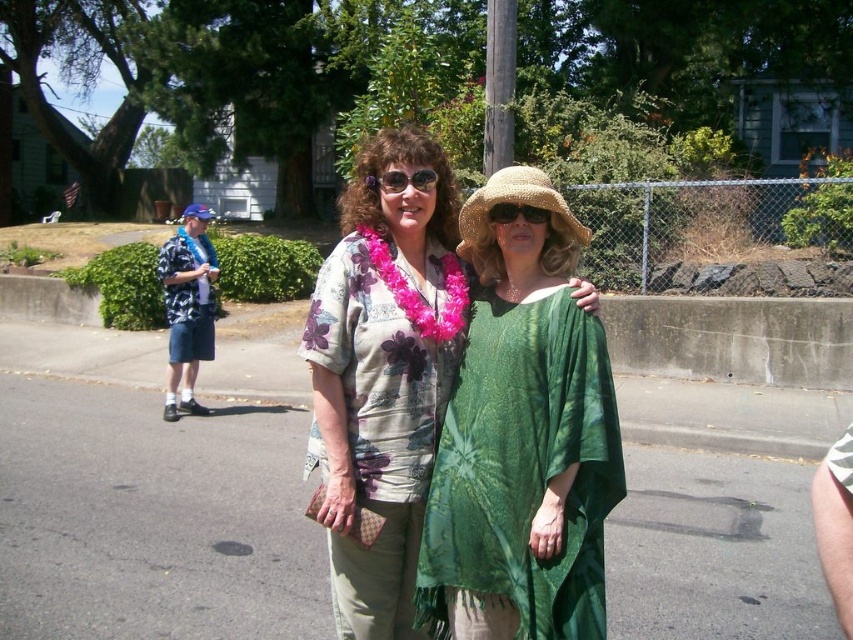
Looking at this image, measure the distance between point (408, 612) and camera.

They are 2.83 meters apart.

Is floral print blouse at center above green tie-dye dress at center?

Indeed, floral print blouse at center is positioned over green tie-dye dress at center.

Does point (415, 474) lie behind point (526, 340)?

Yes, it is behind point (526, 340).

The image size is (853, 640). Identify the location of floral print blouse at center. (383, 376).

At what (x,y) coordinates should I click in order to perform the action: click on floral print blouse at center. Please return your answer as a coordinate pair (x, y). The width and height of the screenshot is (853, 640). Looking at the image, I should click on (383, 376).

Who is positioned more to the left, floral print blouse at center or hawaiian print fabric shirt at left?

Positioned to the left is hawaiian print fabric shirt at left.

At what (x,y) coordinates should I click in order to perform the action: click on floral print blouse at center. Please return your answer as a coordinate pair (x, y). Image resolution: width=853 pixels, height=640 pixels. Looking at the image, I should click on (383, 376).

Measure the distance between hawaiian print fabric shirt at left and sunglassesbrown at center.

Answer: 6.38 meters

Who is more forward, (202, 300) or (512, 216)?

Point (512, 216) is in front.

Does point (202, 316) come closer to viewer compared to point (515, 209)?

No, (202, 316) is further to viewer.

Where is `hawaiian print fabric shirt at left`? The width and height of the screenshot is (853, 640). hawaiian print fabric shirt at left is located at coordinates (189, 296).